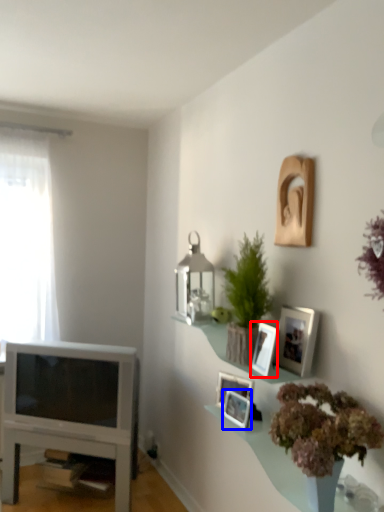
Question: Which object is further to the camera taking this photo, picture frame (highlighted by a red box) or picture frame (highlighted by a blue box)?

Choices:
 (A) picture frame
 (B) picture frame

Answer: (B)